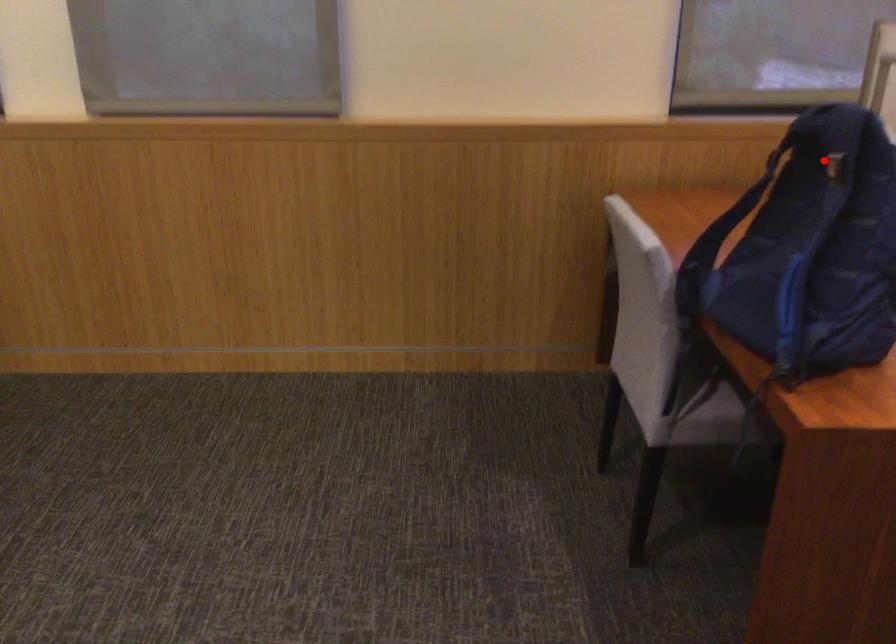
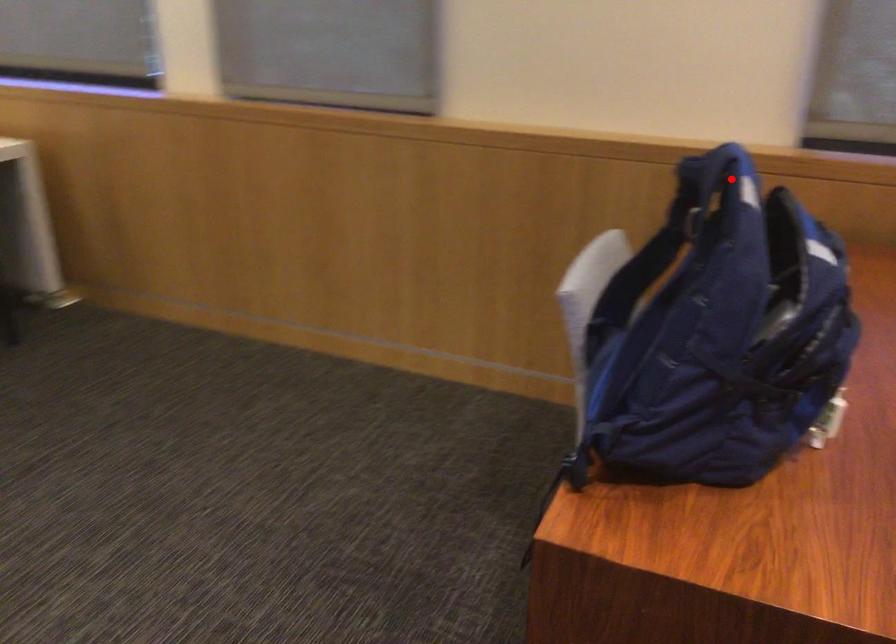
I am providing you with two images of the same scene from different viewpoints. A red point is marked on the first image and another point is marked on the second image. Does the point marked in image1 correspond to the same location as the one in image2?

No